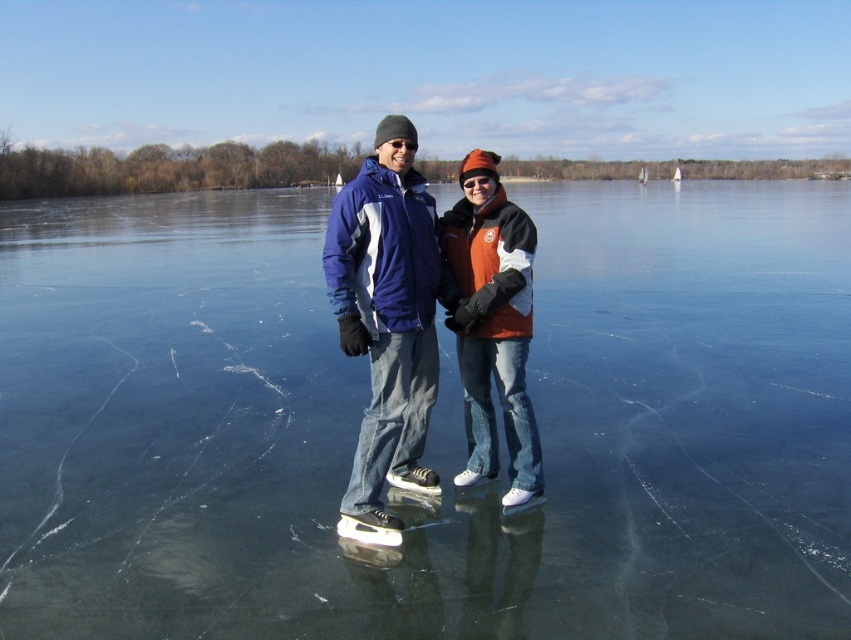
You are an ice skater trying to find the safest spot to glide on the frozen lake. According to the image, where is the transparent ice at center located?

The transparent ice at center is located at point (430, 426), which is the safest spot to glide on the frozen lake.

You are standing at the point with coordinates point (366, 170) and want to move towards the point with coordinates point (444, 396). Is the point you want to reach located behind you or in front of you?

The point (444, 396) is behind point (366, 170), so the point you want to reach is located behind you.

You are an ice skater planning to glide across the transparent ice at center and the matte blue jacket at center. Which surface will allow you to move more smoothly?

The transparent ice at center has a larger size compared to the matte blue jacket at center, so the transparent ice at center will allow smoother movement because larger surfaces provide better glide on ice.